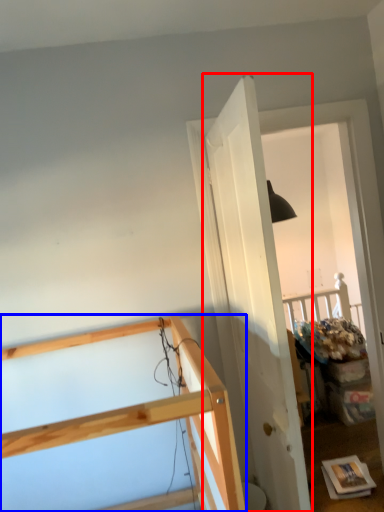
Question: Which object is further to the camera taking this photo, door (highlighted by a red box) or furniture (highlighted by a blue box)?

Choices:
 (A) door
 (B) furniture

Answer: (A)